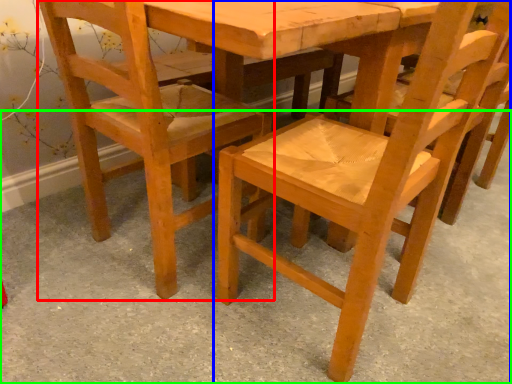
Question: Based on their relative distances, which object is nearer to chair (highlighted by a red box)? Choose from chair (highlighted by a blue box) and concrete (highlighted by a green box).

Choices:
 (A) chair
 (B) concrete

Answer: (A)